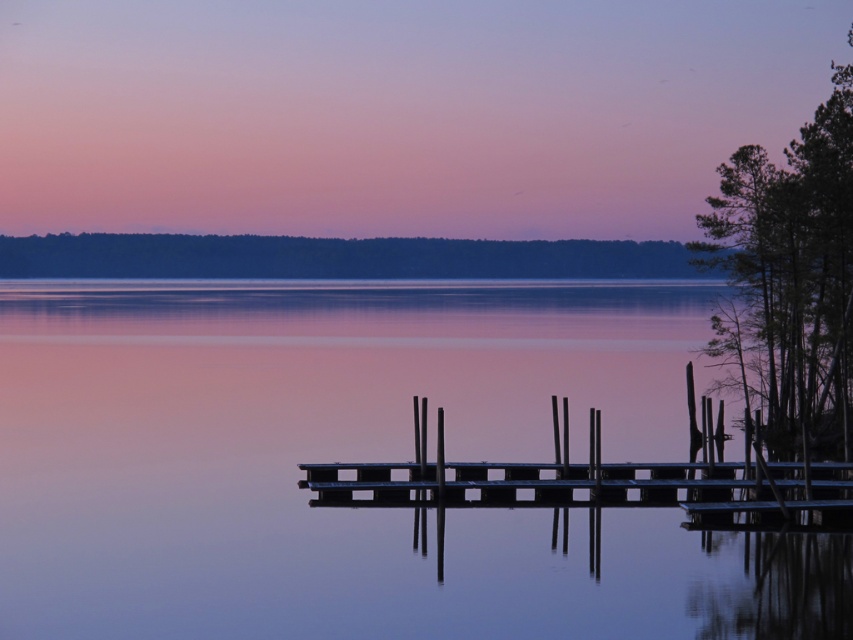
Question: In this image, where is smooth water at center located relative to metallic dock at center?

Choices:
 (A) below
 (B) above

Answer: (B)

Question: Does smooth water at center lie behind metallic dock at center?

Choices:
 (A) no
 (B) yes

Answer: (A)

Question: Is smooth water at center wider than metallic dock at center?

Choices:
 (A) no
 (B) yes

Answer: (B)

Question: Which object is closer to the camera taking this photo?

Choices:
 (A) smooth water at center
 (B) metallic dock at center

Answer: (A)